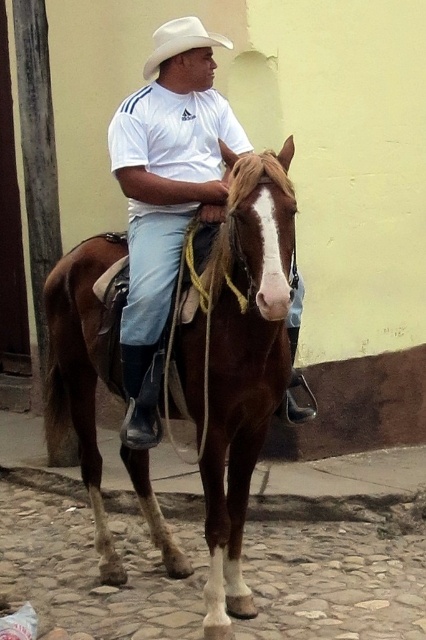
Question: Does brown glossy horse at center appear on the right side of white matte shirt at center?

Choices:
 (A) yes
 (B) no

Answer: (A)

Question: Among these points, which one is farthest from the camera?

Choices:
 (A) (207, 474)
 (B) (164, 60)

Answer: (B)

Question: Does brown glossy horse at center have a greater width compared to white matte cowboy hat at upper center?

Choices:
 (A) no
 (B) yes

Answer: (B)

Question: Which is farther from the white matte cowboy hat at upper center?

Choices:
 (A) white matte shirt at center
 (B) brown glossy horse at center

Answer: (B)

Question: Can you confirm if brown glossy horse at center is positioned below white matte shirt at center?

Choices:
 (A) no
 (B) yes

Answer: (B)

Question: Which is nearer to the white matte shirt at center?

Choices:
 (A) brown glossy horse at center
 (B) white matte cowboy hat at upper center

Answer: (A)